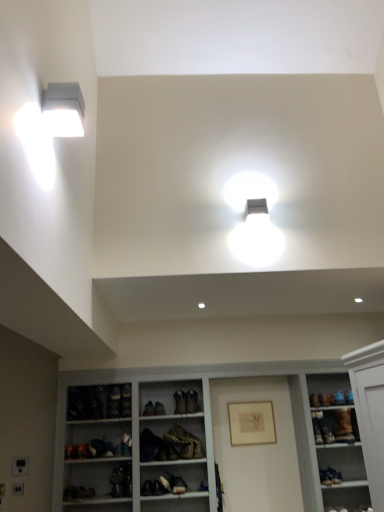
Question: From a real-world perspective, is white wood shelves at center over brown suede shoe at lower right, the third shoe viewed from the left?

Choices:
 (A) no
 (B) yes

Answer: (A)

Question: Does white wood shelves at center have a lesser height compared to brown suede shoe at lower right, the first shoe viewed from the right?

Choices:
 (A) no
 (B) yes

Answer: (A)

Question: Would you say white wood shelves at center is outside brown suede shoe at lower right, the third shoe viewed from the left?

Choices:
 (A) no
 (B) yes

Answer: (B)

Question: Is white wood shelves at center turned away from brown suede shoe at lower right, the third shoe viewed from the left?

Choices:
 (A) yes
 (B) no

Answer: (A)

Question: Would you say white wood shelves at center contains brown suede shoe at lower right, the first shoe viewed from the right?

Choices:
 (A) yes
 (B) no

Answer: (A)

Question: Considering the relative positions of white matte rectangular light fixture at upper left and brown suede shoe at lower right, the third shoe viewed from the left, in the image provided, is white matte rectangular light fixture at upper left to the left or to the right of brown suede shoe at lower right, the third shoe viewed from the left,?

Choices:
 (A) right
 (B) left

Answer: (B)

Question: From a real-world perspective, is white matte rectangular light fixture at upper left above or below brown suede shoe at lower right, the first shoe viewed from the right?

Choices:
 (A) below
 (B) above

Answer: (B)

Question: Is white matte rectangular light fixture at upper left wider or thinner than brown suede shoe at lower right, the first shoe viewed from the right?

Choices:
 (A) wide
 (B) thin

Answer: (B)

Question: Is point (69, 91) closer or farther from the camera than point (339, 423)?

Choices:
 (A) farther
 (B) closer

Answer: (B)

Question: From the image's perspective, is white wood shelves at center located above or below white matte exhaust hood at upper left?

Choices:
 (A) below
 (B) above

Answer: (A)

Question: Which is correct: white wood shelves at center is inside white matte exhaust hood at upper left, or outside of it?

Choices:
 (A) outside
 (B) inside

Answer: (A)

Question: In terms of width, does white wood shelves at center look wider or thinner when compared to white matte exhaust hood at upper left?

Choices:
 (A) wide
 (B) thin

Answer: (B)

Question: Considering the positions of white wood shelves at center and white matte exhaust hood at upper left in the image, is white wood shelves at center bigger or smaller than white matte exhaust hood at upper left?

Choices:
 (A) small
 (B) big

Answer: (B)

Question: In terms of height, does matte black shoe at center, positioned as the second shoe in right-to-left order, look taller or shorter compared to leather jacket at center?

Choices:
 (A) tall
 (B) short

Answer: (B)

Question: Is point (187, 398) positioned closer to the camera than point (155, 445)?

Choices:
 (A) farther
 (B) closer

Answer: (A)